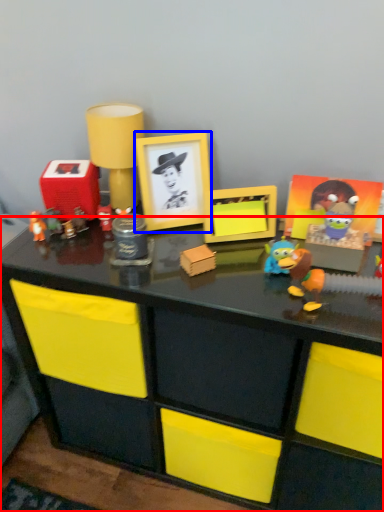
Question: Which object appears farthest to the camera in this image, desk (highlighted by a red box) or picture frame (highlighted by a blue box)?

Choices:
 (A) desk
 (B) picture frame

Answer: (B)